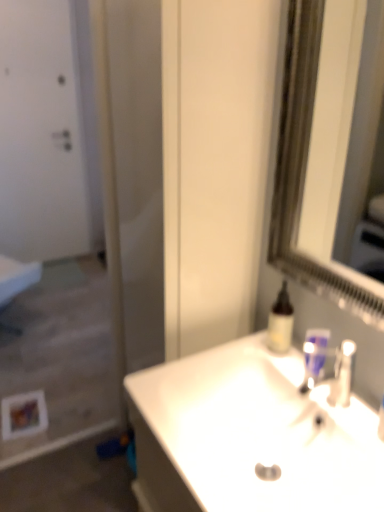
You are a GUI agent. You are given a task and a screenshot of the screen. Output one action in this format:
    pyautogui.click(x=<x>, y=<y>)
    Task: Click on the white matte screen door at left
    
    Given the screenshot: What is the action you would take?
    pyautogui.click(x=55, y=223)

In order to face white matte door at upper left, should I rotate leftwards or rightwards?

Rotate left and turn 19.958 degrees.

What are the coordinates of `white matte screen door at left` in the screenshot? It's located at (55, 223).

Based on their sizes in the image, would you say translucent plastic bottle at upper right, acting as the 2th mouthwash starting from the right, is bigger or smaller than silver metallic mirror at upper right?

In the image, translucent plastic bottle at upper right, acting as the 2th mouthwash starting from the right, appears to be smaller than silver metallic mirror at upper right.

Would you say translucent plastic bottle at upper right, acting as the 2th mouthwash starting from the right, is outside silver metallic mirror at upper right?

translucent plastic bottle at upper right, acting as the 2th mouthwash starting from the right, lies outside silver metallic mirror at upper right's area.

Is translucent plastic bottle at upper right, acting as the 2th mouthwash starting from the right, next to silver metallic mirror at upper right and touching it?

No, translucent plastic bottle at upper right, acting as the 2th mouthwash starting from the right, is not touching silver metallic mirror at upper right.

Is translucent plastic bottle at upper right, acting as the 2th mouthwash starting from the right, not within white matte screen door at left?

Yes.

Can you confirm if translucent plastic bottle at upper right, acting as the 2th mouthwash starting from the right, is shorter than white matte screen door at left?

Yes, translucent plastic bottle at upper right, acting as the 2th mouthwash starting from the right, is shorter than white matte screen door at left.

Between translucent plastic bottle at upper right, acting as the 2th mouthwash starting from the right, and white matte screen door at left, which one has larger size?

white matte screen door at left is bigger.

From a real-world perspective, is translucent plastic bottle at upper right, acting as the 2th mouthwash starting from the right, physically above white matte screen door at left?

Yes, from a real-world perspective, translucent plastic bottle at upper right, acting as the 2th mouthwash starting from the right, is over white matte screen door at left

From a real-world perspective, which object stands above the other?

From a 3D spatial view, blue plastic mouthwash at sink, the first mouthwash viewed from the right, is above.

From the picture: Is white glossy sink at center facing towards blue plastic mouthwash at sink, which is the second mouthwash from left to right?

No, white glossy sink at center is not turned towards blue plastic mouthwash at sink, which is the second mouthwash from left to right.

Is white glossy sink at center far away from blue plastic mouthwash at sink, which is the second mouthwash from left to right?

Actually, white glossy sink at center and blue plastic mouthwash at sink, which is the second mouthwash from left to right, are a little close together.

Is white glossy sink at center bigger or smaller than blue plastic mouthwash at sink, which is the second mouthwash from left to right?

Considering their sizes, white glossy sink at center takes up more space than blue plastic mouthwash at sink, which is the second mouthwash from left to right.

Is white glossy sink at center oriented towards white matte door at upper left?

No, white glossy sink at center is not facing towards white matte door at upper left.

Would you say white glossy sink at center contains white matte door at upper left?

Definitely not — white matte door at upper left is not inside white glossy sink at center.

Does white glossy sink at center have a greater width compared to white matte door at upper left?

Correct, the width of white glossy sink at center exceeds that of white matte door at upper left.

From a real-world perspective, is silver metallic mirror at upper right below white matte screen door at left?

Actually, silver metallic mirror at upper right is physically above white matte screen door at left in the real world.

Can you see silver metallic mirror at upper right touching white matte screen door at left?

They are not placed beside each other.

Is silver metallic mirror at upper right taller or shorter than white matte screen door at left?

In the image, silver metallic mirror at upper right appears to be shorter than white matte screen door at left.

From a real-world perspective, between white glossy sink at center and translucent plastic bottle at upper right, acting as the 2th mouthwash starting from the right, who is vertically lower?

From a 3D spatial view, white glossy sink at center is below.

Which of these two, white glossy sink at center or translucent plastic bottle at upper right, acting as the 2th mouthwash starting from the right, is thinner?

translucent plastic bottle at upper right, acting as the 2th mouthwash starting from the right.

Is white glossy sink at center beside translucent plastic bottle at upper right, acting as the 2th mouthwash starting from the right?

white glossy sink at center is not next to translucent plastic bottle at upper right, acting as the 2th mouthwash starting from the right, and they're not touching.

How different are the orientations of white glossy sink at center and translucent plastic bottle at upper right, acting as the 2th mouthwash starting from the right, in degrees?

The angular difference between white glossy sink at center and translucent plastic bottle at upper right, acting as the 2th mouthwash starting from the right, is 38 degrees.

Considering the sizes of objects white matte screen door at left and white matte door at upper left in the image provided, who is taller, white matte screen door at left or white matte door at upper left?

Standing taller between the two is white matte door at upper left.

Where is `screen door on the right of white matte door at upper left`? The height and width of the screenshot is (512, 384). screen door on the right of white matte door at upper left is located at coordinates (55, 223).

Is white matte screen door at left directly adjacent to white matte door at upper left?

white matte screen door at left is not next to white matte door at upper left, and they're not touching.

Where is `mirror in front of the translucent plastic bottle at upper right, which is the first mouthwash in left-to-right order`? The height and width of the screenshot is (512, 384). mirror in front of the translucent plastic bottle at upper right, which is the first mouthwash in left-to-right order is located at coordinates (323, 141).

The width and height of the screenshot is (384, 512). Identify the location of screen door that appears on the left of translucent plastic bottle at upper right, acting as the 2th mouthwash starting from the right. (55, 223).

Based on their spatial positions, is blue plastic mouthwash at sink, the first mouthwash viewed from the right, or translucent plastic bottle at upper right, which is the first mouthwash in left-to-right order, further from white matte screen door at left?

blue plastic mouthwash at sink, the first mouthwash viewed from the right, is positioned further to the anchor white matte screen door at left.

In the scene shown: When comparing their distances from white glossy sink at center, does translucent plastic bottle at upper right, which is the first mouthwash in left-to-right order, or white matte screen door at left seem further?

white matte screen door at left.

Considering their positions, is white matte door at upper left positioned closer to white glossy sink at center than white matte screen door at left?

Among the two, white matte screen door at left is located nearer to white glossy sink at center.

Consider the image. Based on their spatial positions, is white glossy sink at center or white matte door at upper left further from silver metallic mirror at upper right?

white matte door at upper left is positioned further to the anchor silver metallic mirror at upper right.

When comparing their distances from white glossy sink at center, does silver metallic mirror at upper right or white matte screen door at left seem further?

Among the two, white matte screen door at left is located further to white glossy sink at center.

When comparing their distances from silver metallic mirror at upper right, does translucent plastic bottle at upper right, which is the first mouthwash in left-to-right order, or white matte door at upper left seem closer?

Among the two, translucent plastic bottle at upper right, which is the first mouthwash in left-to-right order, is located nearer to silver metallic mirror at upper right.

When comparing their distances from white glossy sink at center, does blue plastic mouthwash at sink, the first mouthwash viewed from the right, or white matte door at upper left seem further?

white matte door at upper left is further to white glossy sink at center.

Looking at the image, which one is located further to white matte screen door at left, white matte door at upper left or blue plastic mouthwash at sink, which is the second mouthwash from left to right?

blue plastic mouthwash at sink, which is the second mouthwash from left to right, lies further to white matte screen door at left than the other object.

Locate an element on the screen. Image resolution: width=384 pixels, height=512 pixels. screen door between silver metallic mirror at upper right and white matte door at upper left in the front-back direction is located at coordinates tap(55, 223).

At what (x,y) coordinates should I click in order to perform the action: click on mirror located between white glossy sink at center and white matte door at upper left in the depth direction. Please return your answer as a coordinate pair (x, y). The height and width of the screenshot is (512, 384). Looking at the image, I should click on (323, 141).

The height and width of the screenshot is (512, 384). Identify the location of mouthwash between silver metallic mirror at upper right and translucent plastic bottle at upper right, which is the first mouthwash in left-to-right order, in the front-back direction. (314, 355).

Find the location of a particular element. This screenshot has height=512, width=384. sink between white matte screen door at left and silver metallic mirror at upper right from left to right is located at coordinates (249, 436).